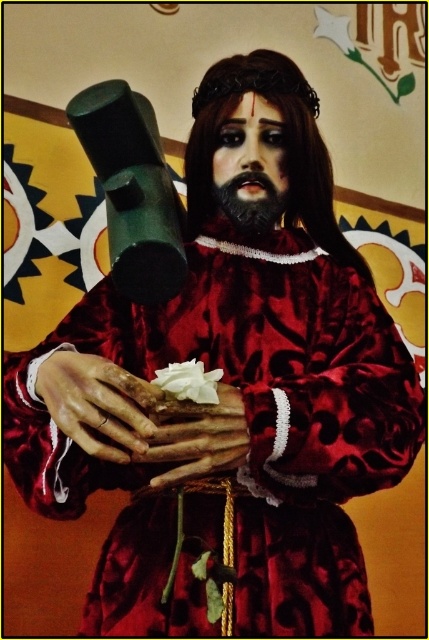
In the scene shown: Where is the smooth leather gloves at center located in the image?

The smooth leather gloves at center is located at point [196,436].

You are an artist sketching the figure in the image. You need to decide which object to draw first based on their size. Which one should you start with, the smooth leather gloves at center or the black matte beard at center?

The smooth leather gloves at center is much taller than the black matte beard at center, so you should start drawing the smooth leather gloves at center first because it is larger in size.